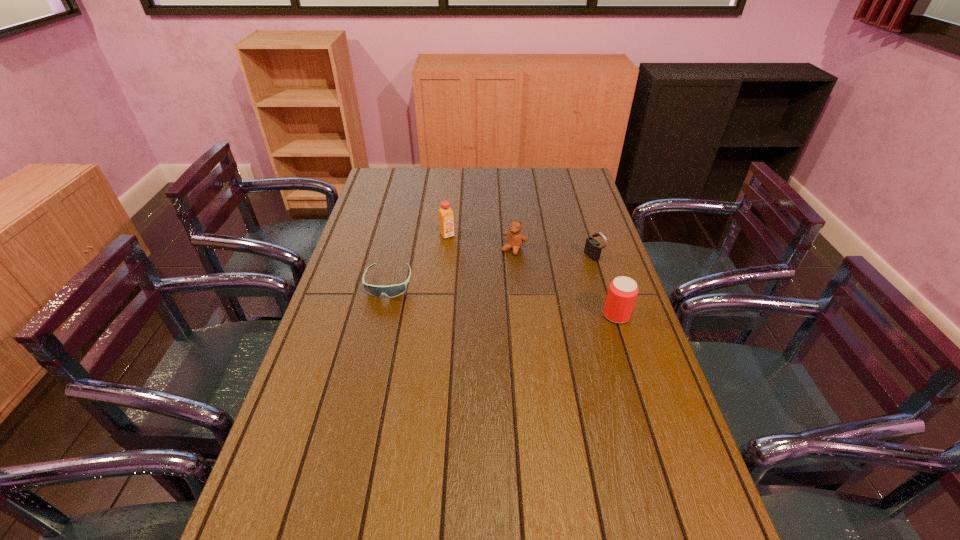
This screenshot has width=960, height=540. Identify the location of padlock that is at the right edge. (593, 248).

In order to click on vacant area at the far edge of the desktop in this screenshot , I will do `click(467, 193)`.

The height and width of the screenshot is (540, 960). In the image, there is a desktop. Identify the location of free space at the near edge. (614, 532).

The image size is (960, 540). I want to click on free space at the left edge of the desktop, so click(x=364, y=318).

In the image, there is a desktop. In order to click on free region at the right edge in this screenshot , I will do `click(583, 255)`.

In the image, there is a desktop. Identify the location of vacant space at the far left corner. The image size is (960, 540). (406, 170).

Locate an element on the screen. The image size is (960, 540). free point at the near left corner is located at coordinates (286, 514).

I want to click on vacant area between the nearest object and the leftmost object, so click(502, 299).

You are a GUI agent. You are given a task and a screenshot of the screen. Output one action in this format:
    pyautogui.click(x=<x>, y=<y>)
    Task: Click on the free space between the teddy bear and the farthest object
    The image size is (960, 540).
    Given the screenshot: What is the action you would take?
    pyautogui.click(x=481, y=242)

You are a GUI agent. You are given a task and a screenshot of the screen. Output one action in this format:
    pyautogui.click(x=<x>, y=<y>)
    Task: Click on the free area in between the nearest object and the third object from right to left
    Image resolution: width=960 pixels, height=540 pixels.
    Given the screenshot: What is the action you would take?
    point(565,282)